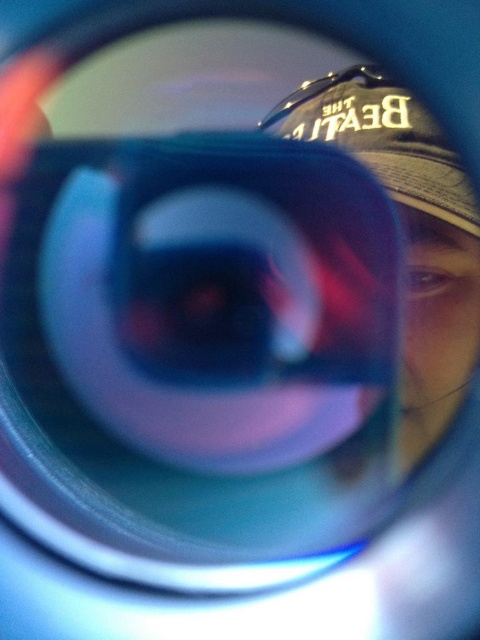
Looking at this image, is transparent plastic magnifying glass at center below matte black baseball cap at upper right?

Indeed, transparent plastic magnifying glass at center is positioned under matte black baseball cap at upper right.

Which of these two, transparent plastic magnifying glass at center or matte black baseball cap at upper right, stands taller?

With more height is transparent plastic magnifying glass at center.

Between point (338, 211) and point (294, 106), which one is positioned in front?

Point (338, 211) is more forward.

The height and width of the screenshot is (640, 480). In order to click on transparent plastic magnifying glass at center in this screenshot , I will do `click(225, 298)`.